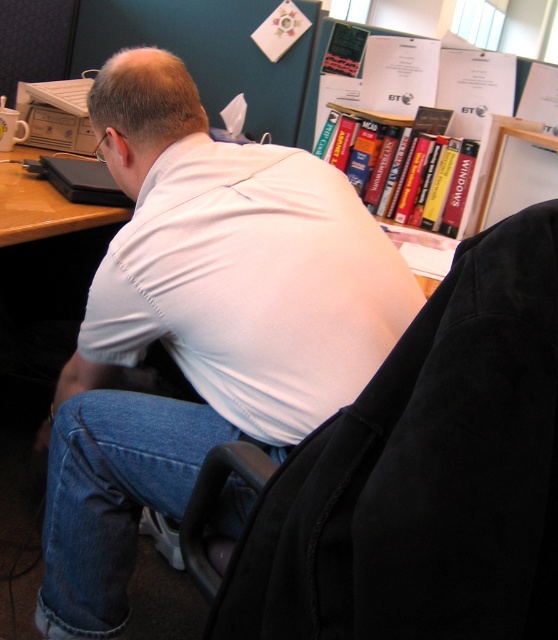
Which is behind, point (319, 323) or point (358, 570)?

Point (319, 323)

Can you confirm if white matte shirt at upper center is positioned to the right of black fabric swivel chair at center?

Incorrect, white matte shirt at upper center is not on the right side of black fabric swivel chair at center.

Describe the element at coordinates (201, 324) in the screenshot. I see `white matte shirt at upper center` at that location.

Where is `white matte shirt at upper center`? This screenshot has height=640, width=558. white matte shirt at upper center is located at coordinates (201, 324).